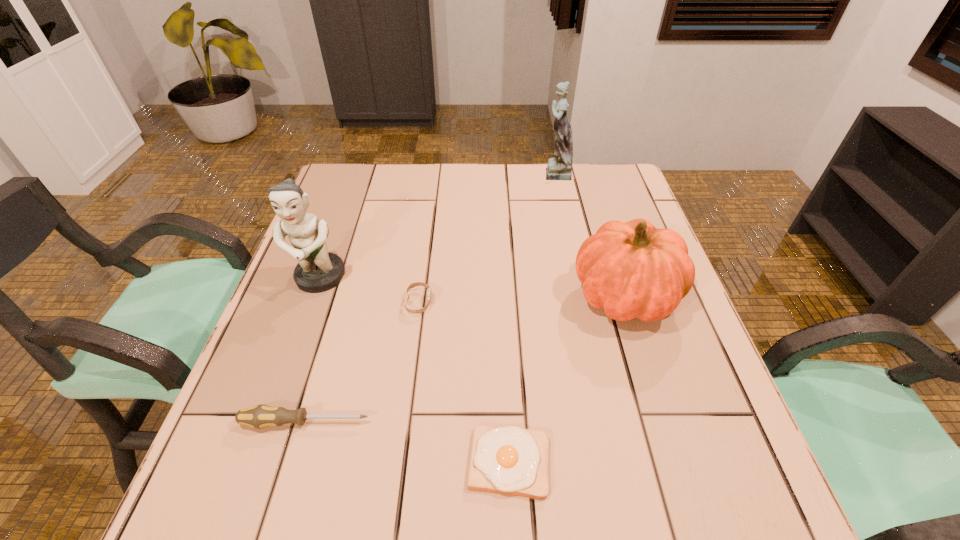
Locate an element on the screen. Image resolution: width=960 pixels, height=540 pixels. object located in the right edge section of the desktop is located at coordinates (632, 270).

Find the location of a particular element. The width and height of the screenshot is (960, 540). free space at the far edge of the desktop is located at coordinates (541, 194).

Locate an element on the screen. vacant area at the left edge of the desktop is located at coordinates (331, 242).

I want to click on free spot at the right edge of the desktop, so click(658, 442).

At what (x,y) coordinates should I click in order to perform the action: click on blank space at the far left corner of the desktop. Please return your answer as a coordinate pair (x, y). This screenshot has width=960, height=540. Looking at the image, I should click on (344, 179).

At what (x,y) coordinates should I click in order to perform the action: click on free space between the nearer figurine and the screwdriver. Please return your answer as a coordinate pair (x, y). Looking at the image, I should click on (313, 350).

Locate an element on the screen. The height and width of the screenshot is (540, 960). free space between the farther figurine and the third tallest object is located at coordinates (589, 234).

The image size is (960, 540). I want to click on empty location between the nearer figurine and the shortest object, so click(415, 370).

The height and width of the screenshot is (540, 960). In order to click on vacant region between the pumpkin and the watch in this screenshot , I will do `click(521, 299)`.

At what (x,y) coordinates should I click in order to perform the action: click on vacant space that is in between the watch and the left figurine. Please return your answer as a coordinate pair (x, y). Looking at the image, I should click on (370, 291).